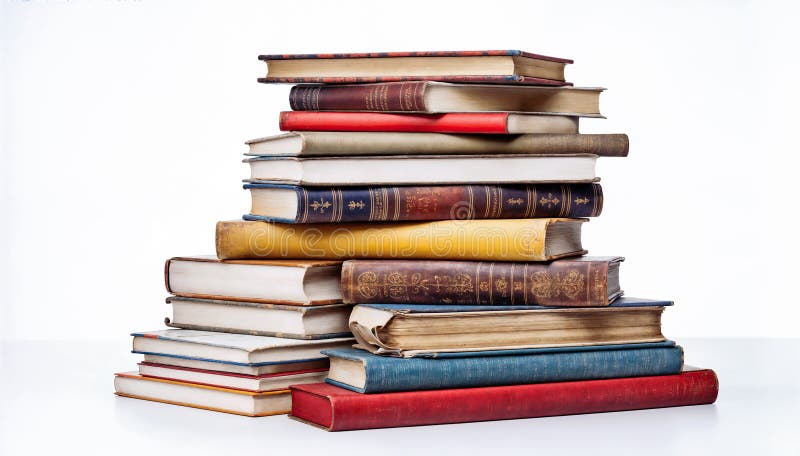
You are a GUI agent. You are given a task and a screenshot of the screen. Output one action in this format:
    pyautogui.click(x=<x>, y=<y>)
    Task: Click on the books with spines exposed
    The width and height of the screenshot is (800, 456).
    Given the screenshot: What is the action you would take?
    pyautogui.click(x=508, y=399), pyautogui.click(x=506, y=361), pyautogui.click(x=476, y=279), pyautogui.click(x=462, y=240), pyautogui.click(x=444, y=200), pyautogui.click(x=449, y=141), pyautogui.click(x=449, y=124), pyautogui.click(x=384, y=95)